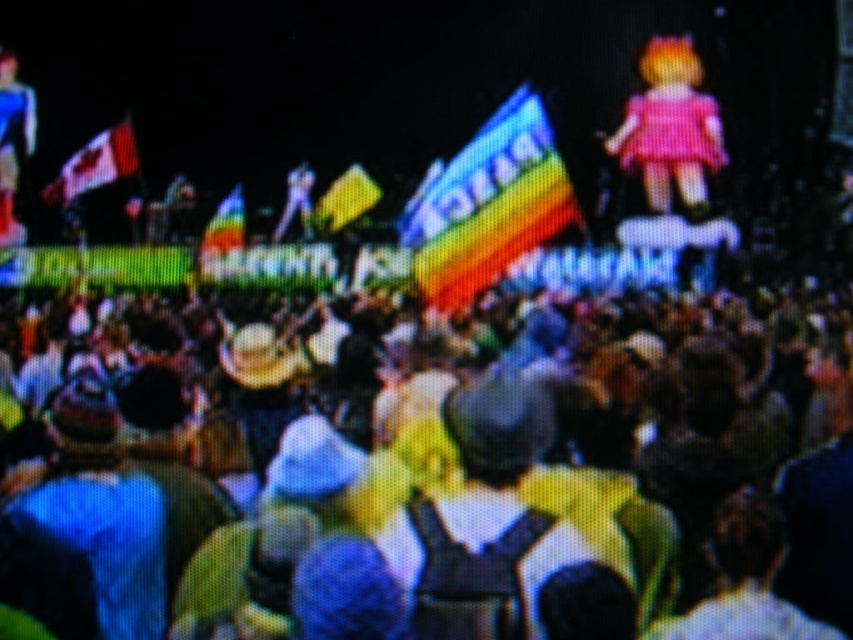
Does multicolored fabric crowd at center have a smaller size compared to matte black flag at upper left?

Incorrect, multicolored fabric crowd at center is not smaller in size than matte black flag at upper left.

Who is lower down, multicolored fabric crowd at center or matte black flag at upper left?

multicolored fabric crowd at center

Is point (312, 460) behind point (94, 164)?

That is False.

Locate an element on the screen. This screenshot has height=640, width=853. multicolored fabric crowd at center is located at coordinates (427, 483).

Can you confirm if matte black flag at upper left is positioned to the right of rainbow fabric flag at upper center?

No, matte black flag at upper left is not to the right of rainbow fabric flag at upper center.

Which is above, matte black flag at upper left or rainbow fabric flag at upper center?

matte black flag at upper left

Is point (78, 180) in front of point (236, 195)?

No, (78, 180) is behind (236, 195).

Locate an element on the screen. matte black flag at upper left is located at coordinates (96, 164).

Can you confirm if rainbow fabric flag at center is shorter than rainbow fabric flag at upper center?

Incorrect, rainbow fabric flag at center's height does not fall short of rainbow fabric flag at upper center's.

Can you confirm if rainbow fabric flag at center is smaller than rainbow fabric flag at upper center?

No.

Image resolution: width=853 pixels, height=640 pixels. What do you see at coordinates (486, 204) in the screenshot?
I see `rainbow fabric flag at center` at bounding box center [486, 204].

The height and width of the screenshot is (640, 853). In order to click on rainbow fabric flag at center in this screenshot , I will do `click(486, 204)`.